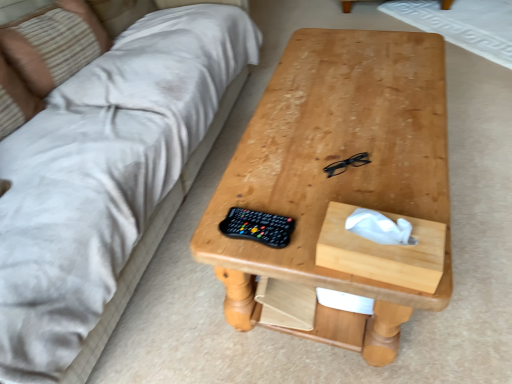
You are a GUI agent. You are given a task and a screenshot of the screen. Output one action in this format:
    pyautogui.click(x=<x>, y=<y>)
    Task: Click on the empty space that is to the right of black plastic glasses at center
    
    Given the screenshot: What is the action you would take?
    pyautogui.click(x=403, y=156)